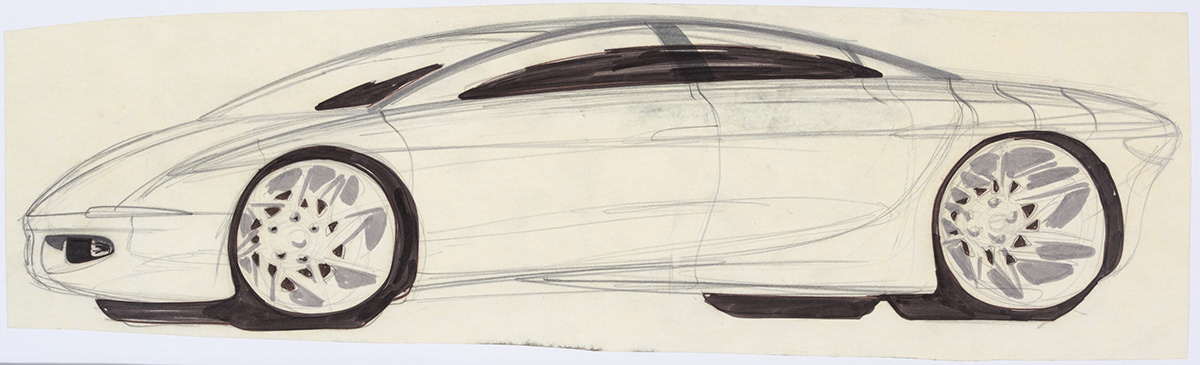
The image size is (1200, 365). I want to click on front door, so click(619, 182).